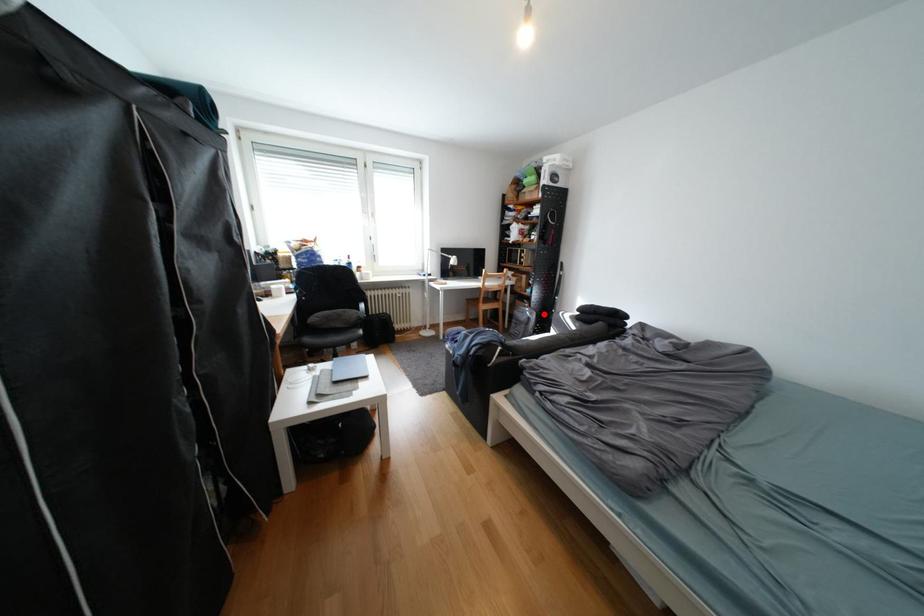
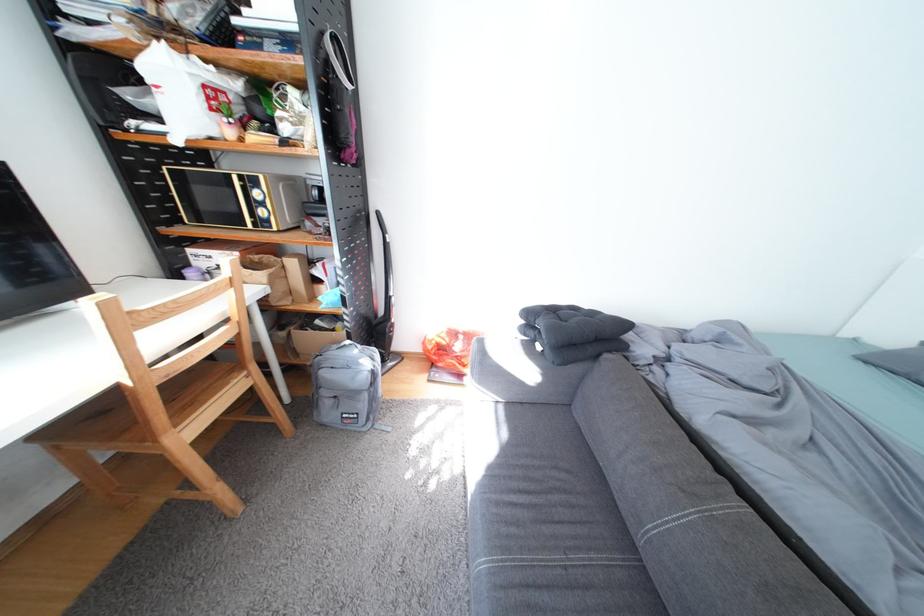
Question: I am providing you with two images of the same scene from different viewpoints. Given a red point in image1, look at the same physical point in image2. Is it:

Choices:
 (A) Closer to the viewpoint
 (B) Farther from the viewpoint

Answer: (A)